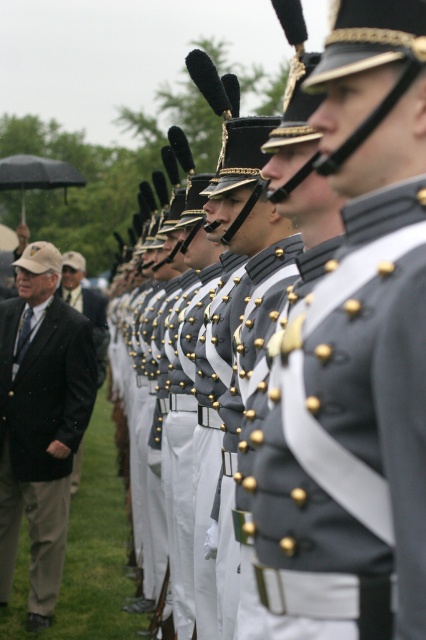
You are a photographer at the military ceremony. You need to capture a photo that includes both the gray matte uniform at center and the black wool jacket at left. Which object should you focus on first to ensure both are in frame?

The gray matte uniform at center is below the black wool jacket at left, so you should focus on the black wool jacket at left first to ensure both are captured in the photo.

You are attending this military ceremony and notice two men on the left side wearing black wool clothing. Which one is shorter in height between the black wool suit at left and the black wool jacket at left?

The black wool suit at left is shorter than the black wool jacket at left.

Based on the scene description, which object is positioned higher in the image between the gray matte uniform at center and the black wool suit at left?

The gray matte uniform at center is positioned higher than the black wool suit at left in the image.